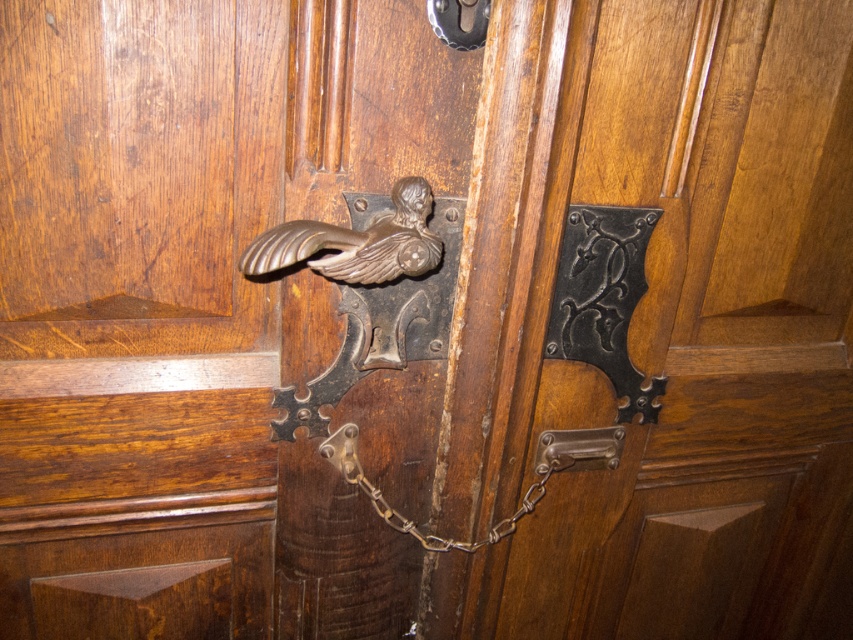
Question: Which object appears closest to the camera in this image?

Choices:
 (A) rusty metal chain at center
 (B) polished dark wood door handle at center
 (C) polished brass handle at center
 (D) metallic silver door handle at center

Answer: (C)

Question: Can you confirm if polished brass handle at center is positioned to the left of metallic silver door handle at center?

Choices:
 (A) no
 (B) yes

Answer: (B)

Question: Which point is closer to the camera taking this photo?

Choices:
 (A) (654, 589)
 (B) (579, 451)

Answer: (B)

Question: In this image, where is polished brass handle at center located relative to bronze polished bird at center?

Choices:
 (A) below
 (B) above

Answer: (A)

Question: Does polished dark wood door handle at center appear over metallic silver door handle at center?

Choices:
 (A) yes
 (B) no

Answer: (A)

Question: Which point is farther to the camera?

Choices:
 (A) rusty metal chain at center
 (B) polished dark wood door handle at center
 (C) metallic silver door handle at center

Answer: (C)